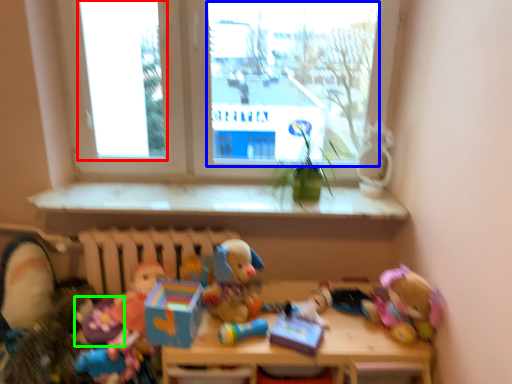
Question: Estimate the real-world distances between objects in this image. Which object is farther from window screen (highlighted by a red box), window screen (highlighted by a blue box) or toy (highlighted by a green box)?

Choices:
 (A) window screen
 (B) toy

Answer: (B)